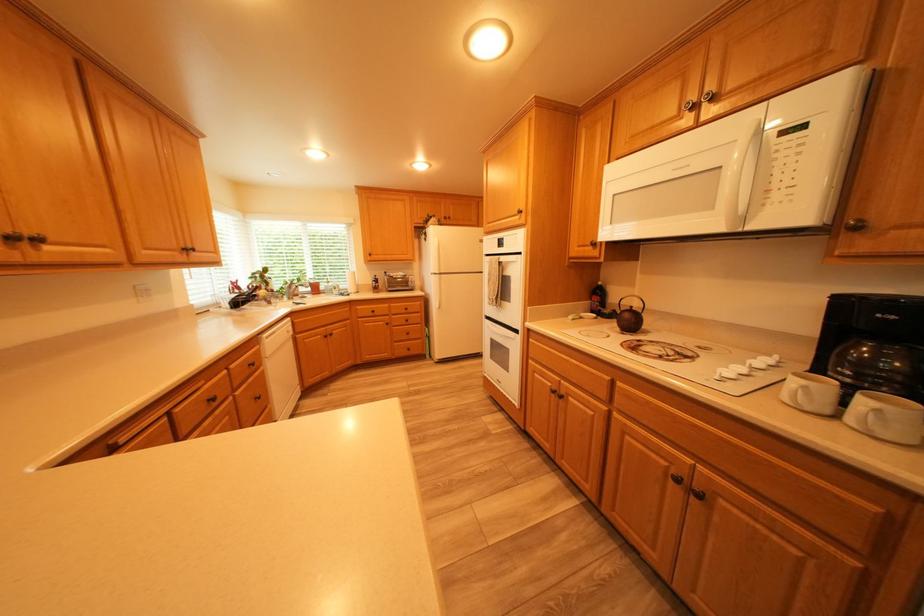
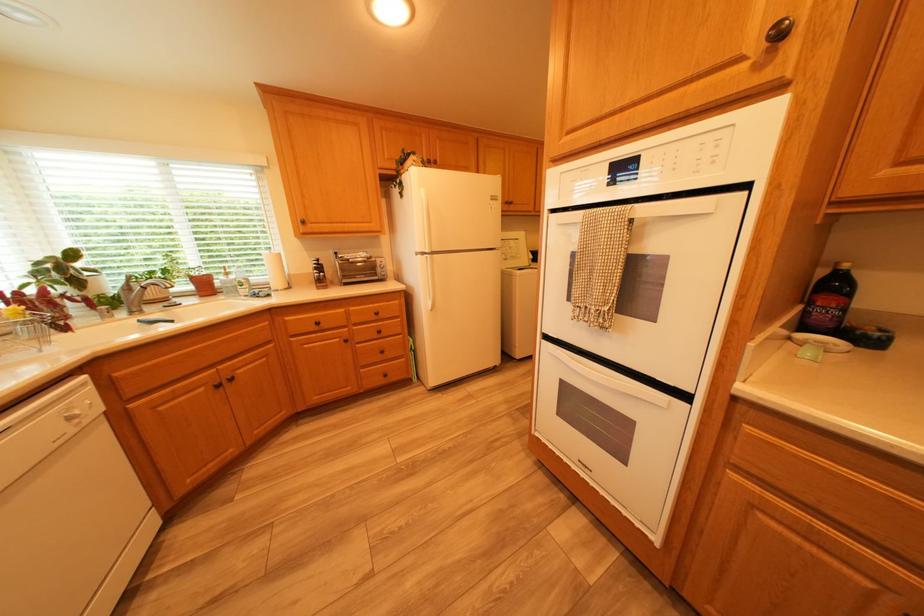
Locate, in the second image, the point that corresponds to the point at 383,282 in the first image.

(322, 269)